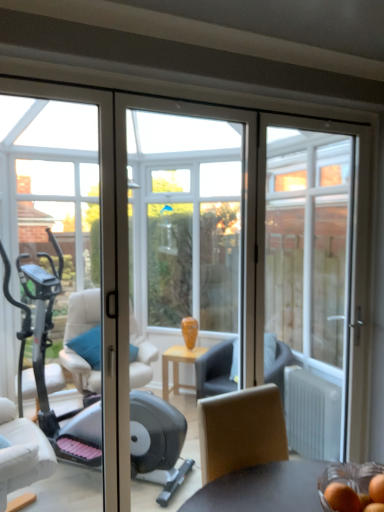
Question: Is orange matte/orange at lower right, which appears as the first food when viewed from the left, smaller than transparent glass door at right?

Choices:
 (A) no
 (B) yes

Answer: (B)

Question: From a real-world perspective, is orange matte/orange at lower right, which appears as the first food when viewed from the left, located beneath transparent glass door at right?

Choices:
 (A) yes
 (B) no

Answer: (A)

Question: Considering the relative sizes of orange matte/orange at lower right, which appears as the first food when viewed from the left, and transparent glass door at right in the image provided, is orange matte/orange at lower right, which appears as the first food when viewed from the left, wider than transparent glass door at right?

Choices:
 (A) yes
 (B) no

Answer: (B)

Question: Can you confirm if orange matte/orange at lower right, the second food when ordered from right to left, is taller than transparent glass door at right?

Choices:
 (A) no
 (B) yes

Answer: (A)

Question: Can you confirm if orange matte/orange at lower right, which appears as the first food when viewed from the left, is bigger than transparent glass door at right?

Choices:
 (A) yes
 (B) no

Answer: (B)

Question: Is orange matte/orange at lower right, which appears as the first food when viewed from the left, positioned beyond the bounds of transparent glass door at right?

Choices:
 (A) no
 (B) yes

Answer: (B)

Question: From a real-world perspective, does smooth orange fruit at lower right, the second food when ordered from left to right, sit lower than transparent glass door at right?

Choices:
 (A) no
 (B) yes

Answer: (B)

Question: Is smooth orange fruit at lower right, which is the first food in right-to-left order, far away from transparent glass door at right?

Choices:
 (A) no
 (B) yes

Answer: (B)

Question: From the image's perspective, is smooth orange fruit at lower right, the second food when ordered from left to right, under transparent glass door at right?

Choices:
 (A) yes
 (B) no

Answer: (A)

Question: Are smooth orange fruit at lower right, which is the first food in right-to-left order, and transparent glass door at right beside each other?

Choices:
 (A) no
 (B) yes

Answer: (A)

Question: From the image's perspective, does smooth orange fruit at lower right, which is the first food in right-to-left order, appear higher than transparent glass door at right?

Choices:
 (A) no
 (B) yes

Answer: (A)

Question: Considering the relative sizes of smooth orange fruit at lower right, the second food when ordered from left to right, and transparent glass door at right in the image provided, is smooth orange fruit at lower right, the second food when ordered from left to right, thinner than transparent glass door at right?

Choices:
 (A) yes
 (B) no

Answer: (A)

Question: Is transparent glass door at right oriented towards orange matte/orange at lower right, the second food when ordered from right to left?

Choices:
 (A) yes
 (B) no

Answer: (B)